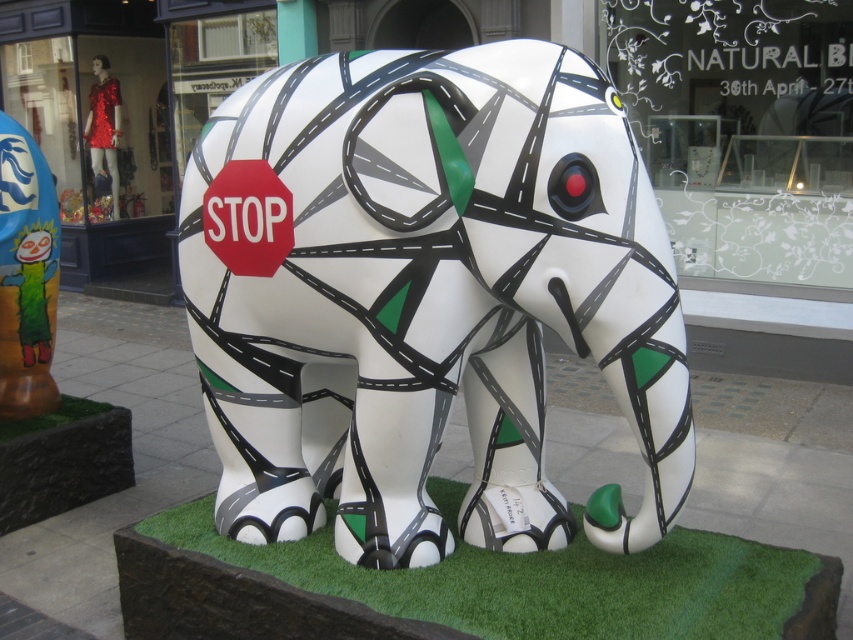
You are a photographer taking a picture of the elephant sculpture. You notice two points on the sculpture marked as point A and point B. Point A is at coordinate point (306, 540) and point B is at coordinate point (33, 264). From your current position, which point will appear larger in your photo?

Point A at coordinate point (306, 540) will appear larger in the photo because it is closer to the camera than point B at coordinate point (33, 264).

You are a gardener planning to replace the matte orange cactus at left and the green artificial turf at lower left with new plants. If you want to keep the same visual balance, which plant should you choose to replace the smaller one?

The matte orange cactus at left is larger in size than the green artificial turf at lower left. To maintain visual balance, replace the smaller green artificial turf at lower left with a plant of similar size.

You are a delivery person trying to place a large package in the space between the white glossy elephant at center and the transparent glass at upper center. Can you fit the package there?

The white glossy elephant at center occupies less space than transparent glass at upper center, so the space between them may be sufficient to fit the package.